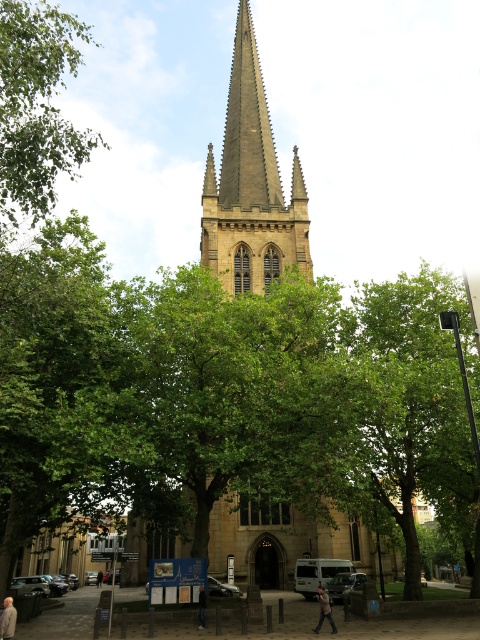
You are standing in front of the grand church with a tall pointed spire. You notice the brown stone spire at center and the dark gray jeans at lower center. Which object is taller?

The brown stone spire at center is taller than the dark gray jeans at lower center.

You are standing in front of the church and want to take a photo of the dark gray jacket at lower center without the green leafy tree at upper left blocking the view. Is this possible?

The green leafy tree at upper left is further to the viewer than the dark gray jacket at lower center, so moving closer to the jacket or adjusting your angle could allow you to take a photo without the tree blocking the view.